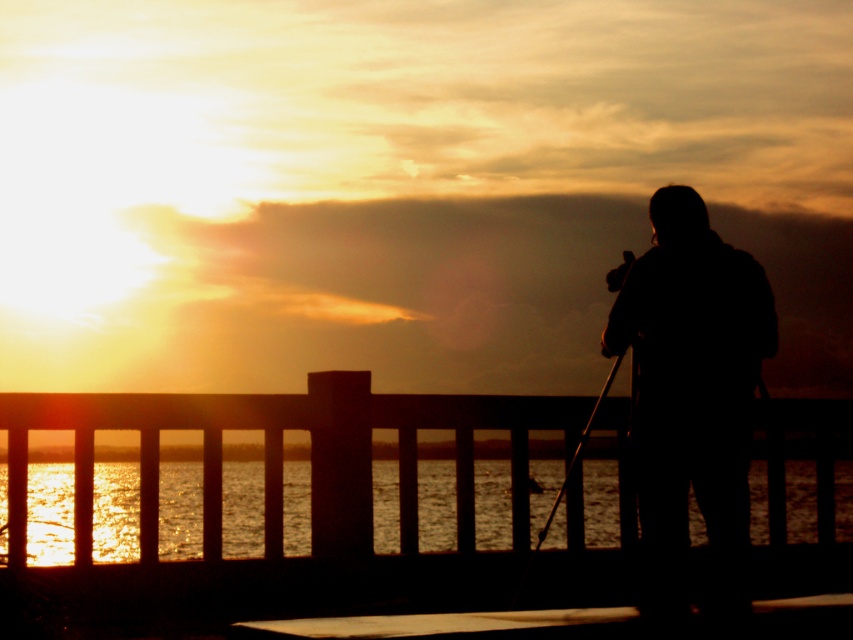
Who is more forward, (239, 525) or (577, 449)?

Positioned in front is point (577, 449).

Does glistening water at lower center have a greater height compared to metallic tripod at right?

Incorrect, glistening water at lower center's height is not larger of metallic tripod at right's.

Is point (238, 486) positioned behind point (561, 496)?

Yes.

Identify the location of glistening water at lower center. The height and width of the screenshot is (640, 853). tap(49, 513).

Can you confirm if silhouette figure at right is bigger than smooth wooden dock at lower center?

Yes, silhouette figure at right is bigger than smooth wooden dock at lower center.

Which is behind, point (612, 349) or point (323, 620)?

The point (612, 349) is behind.

Locate an element on the screen. silhouette figure at right is located at coordinates (691, 394).

Does silhouette figure at right appear on the right side of metallic tripod at right?

Indeed, silhouette figure at right is positioned on the right side of metallic tripod at right.

Measure the distance between silhouette figure at right and camera.

The distance of silhouette figure at right from camera is 9.48 meters.

In order to click on silhouette figure at right in this screenshot , I will do `click(691, 394)`.